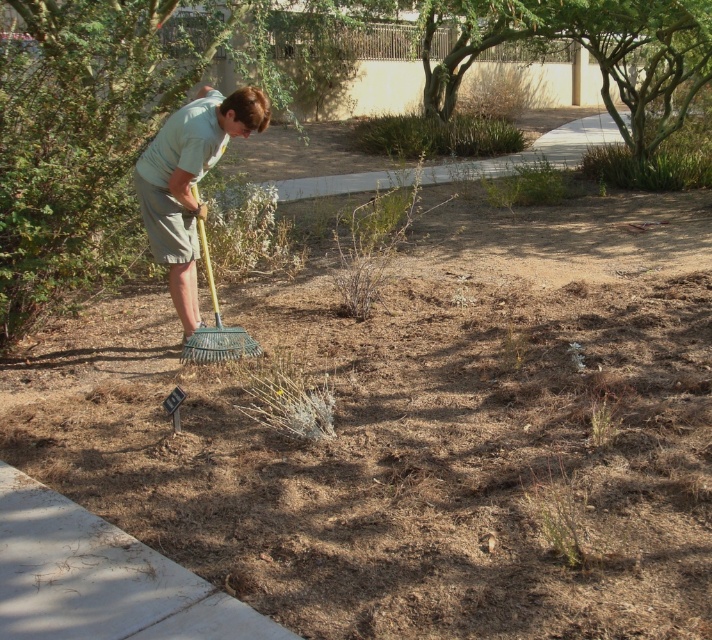
Question: In this image, where is light green fabric at upper left located relative to metallic green rake at center?

Choices:
 (A) above
 (B) below

Answer: (A)

Question: Is light green fabric at upper left closer to camera compared to metallic green rake at center?

Choices:
 (A) no
 (B) yes

Answer: (B)

Question: Which of the following is the closest to the observer?

Choices:
 (A) metallic green rake at center
 (B) light green fabric at upper left

Answer: (B)

Question: Does light green fabric at upper left have a lesser width compared to metallic green rake at center?

Choices:
 (A) yes
 (B) no

Answer: (B)